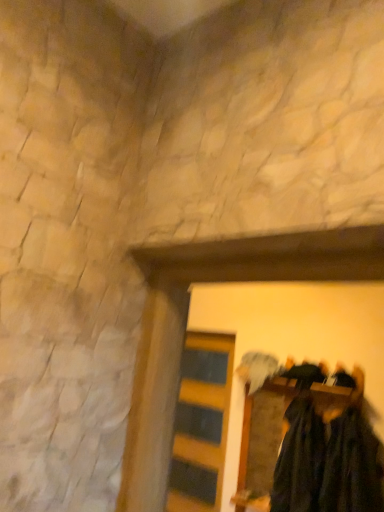
Question: Should I look upward or downward to see yellow striped wood at center?

Choices:
 (A) down
 (B) up

Answer: (A)

Question: Is dark green fabric at center thinner than dark green fabric at lower right, the first clothing in the left-to-right sequence?

Choices:
 (A) no
 (B) yes

Answer: (B)

Question: Does dark green fabric at center have a greater height compared to dark green fabric at lower right, the first clothing in the left-to-right sequence?

Choices:
 (A) yes
 (B) no

Answer: (A)

Question: Is dark green fabric at center facing away from dark green fabric at lower right, the second clothing when ordered from right to left?

Choices:
 (A) no
 (B) yes

Answer: (B)

Question: Is dark green fabric at center further to the viewer compared to dark green fabric at lower right, the first clothing in the left-to-right sequence?

Choices:
 (A) no
 (B) yes

Answer: (A)

Question: From a real-world perspective, is dark green fabric at center positioned over dark green fabric at lower right, the second clothing when ordered from right to left, based on gravity?

Choices:
 (A) no
 (B) yes

Answer: (B)

Question: Is dark green fabric at center located outside dark green fabric at lower right, the second clothing when ordered from right to left?

Choices:
 (A) no
 (B) yes

Answer: (A)

Question: From the image's perspective, is dark green fabric at center beneath yellow striped wood at center?

Choices:
 (A) yes
 (B) no

Answer: (B)

Question: Is dark green fabric at center oriented towards yellow striped wood at center?

Choices:
 (A) yes
 (B) no

Answer: (B)

Question: Considering the relative sizes of dark green fabric at center and yellow striped wood at center in the image provided, is dark green fabric at center wider than yellow striped wood at center?

Choices:
 (A) yes
 (B) no

Answer: (A)

Question: Is yellow striped wood at center located within dark green fabric at center?

Choices:
 (A) yes
 (B) no

Answer: (B)

Question: Is dark green fabric at center oriented away from yellow striped wood at center?

Choices:
 (A) no
 (B) yes

Answer: (A)

Question: Is dark green fabric at center further to the viewer compared to yellow striped wood at center?

Choices:
 (A) yes
 (B) no

Answer: (B)

Question: Is yellow striped wood at center at the right side of dark green fuzzy sweater at lower right, arranged as the 1th clothing when viewed from the right?

Choices:
 (A) no
 (B) yes

Answer: (A)